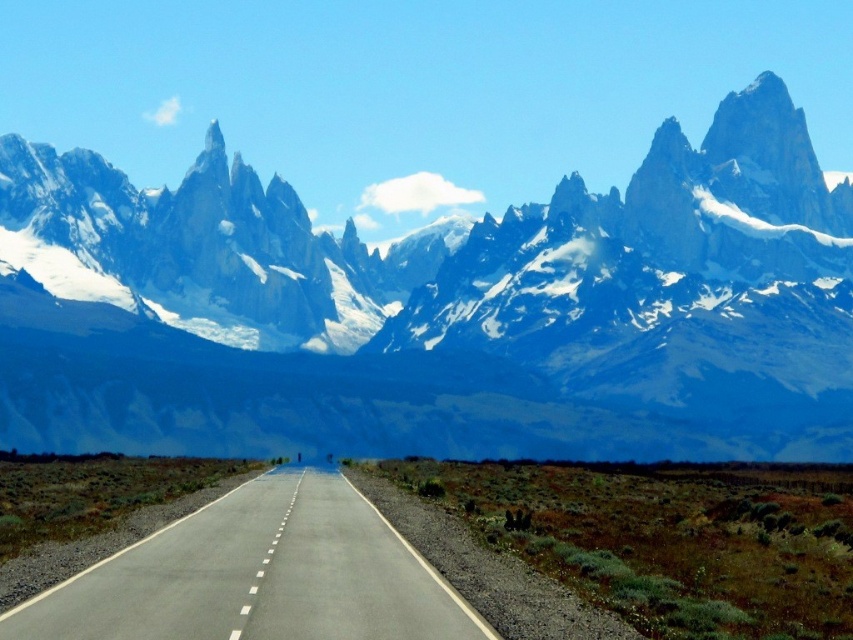
Between snowy granite mountain range at upper center and asphalt road at center, which one is positioned higher?

snowy granite mountain range at upper center is higher up.

Does snowy granite mountain range at upper center appear on the left side of asphalt road at center?

Correct, you'll find snowy granite mountain range at upper center to the left of asphalt road at center.

Measure the distance between snowy granite mountain range at upper center and camera.

435.87 meters

The height and width of the screenshot is (640, 853). Identify the location of snowy granite mountain range at upper center. (438, 310).